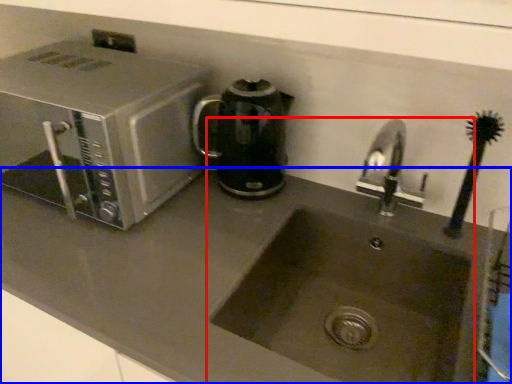
Question: Which object appears closest to the camera in this image, sink (highlighted by a red box) or counter top (highlighted by a blue box)?

Choices:
 (A) sink
 (B) counter top

Answer: (B)